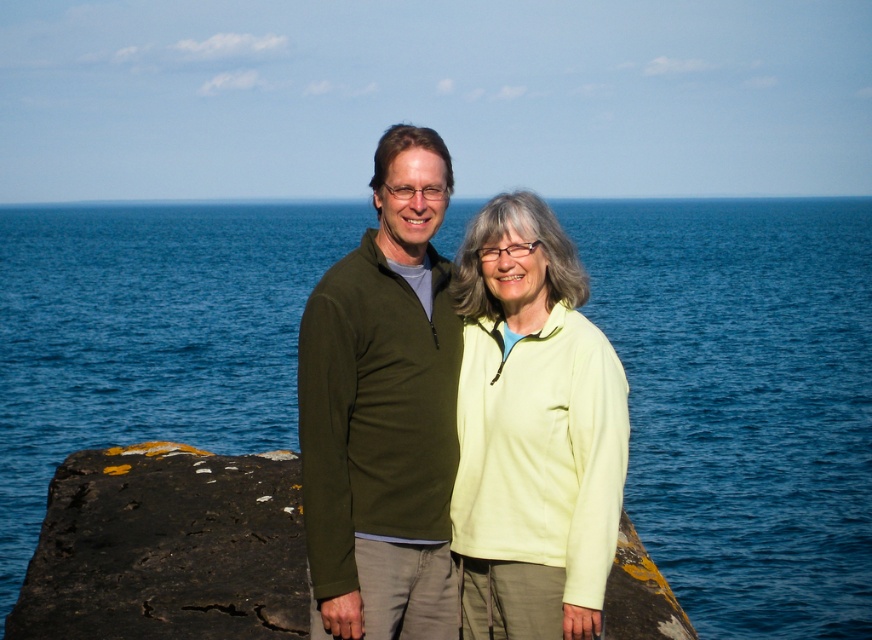
Can you confirm if olive green sweater at center is positioned to the right of black rough rock at center?

Incorrect, olive green sweater at center is not on the right side of black rough rock at center.

Between olive green sweater at center and black rough rock at center, which one appears on the left side from the viewer's perspective?

olive green sweater at center is more to the left.

What do you see at coordinates (383, 410) in the screenshot? This screenshot has height=640, width=872. I see `olive green sweater at center` at bounding box center [383, 410].

The width and height of the screenshot is (872, 640). I want to click on olive green sweater at center, so click(x=383, y=410).

Is blue liquid water at center below light yellow fleece at center?

No, blue liquid water at center is not below light yellow fleece at center.

You are a GUI agent. You are given a task and a screenshot of the screen. Output one action in this format:
    pyautogui.click(x=<x>, y=<y>)
    Task: Click on the blue liquid water at center
    
    Given the screenshot: What is the action you would take?
    pyautogui.click(x=744, y=401)

Does light yellow fleece at center lie in front of black rough rock at center?

Yes, it is in front of black rough rock at center.

Is light yellow fleece at center to the right of black rough rock at center from the viewer's perspective?

Indeed, light yellow fleece at center is positioned on the right side of black rough rock at center.

Where is `light yellow fleece at center`? light yellow fleece at center is located at coordinates [x=532, y=432].